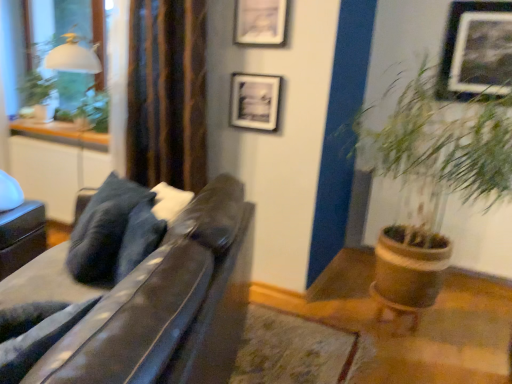
Question: Based on their positions, is metallic silver picture frame at upper right, acting as the first picture frame starting from the right, located to the left or right of matte black swivel chair at left?

Choices:
 (A) right
 (B) left

Answer: (A)

Question: Considering the positions of metallic silver picture frame at upper right, which is the third picture frame in left-to-right order, and matte black swivel chair at left in the image, is metallic silver picture frame at upper right, which is the third picture frame in left-to-right order, wider or thinner than matte black swivel chair at left?

Choices:
 (A) wide
 (B) thin

Answer: (B)

Question: Estimate the real-world distances between objects in this image. Which object is closer to the leather couch at left?

Choices:
 (A) dark blue fabric pillow at center
 (B) brown striped curtain at upper left
 (C) matte black swivel chair at left
 (D) metallic silver picture frame at upper right, which is the third picture frame in left-to-right order
 (E) matte black picture frame at upper center, placed as the first picture frame when sorted from left to right

Answer: (A)

Question: Estimate the real-world distances between objects in this image. Which object is farther from the white glossy table at left?

Choices:
 (A) green leafy plant at upper left
 (B) matte black picture frame at upper center, marked as the 2th picture frame in a right-to-left arrangement
 (C) brown striped curtain at upper left
 (D) metallic silver picture frame at upper right, acting as the first picture frame starting from the right
 (E) green leafy plant at right

Answer: (D)